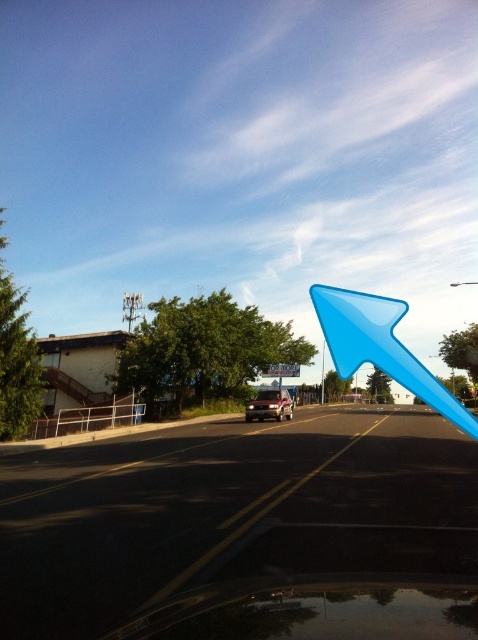
Question: Which of these objects is positioned closest to the satin silver suv at center?

Choices:
 (A) blue plastic pole at center
 (B) black asphalt parking lot at center
 (C) white plastic street sign at center

Answer: (C)

Question: Does satin silver suv at center come in front of blue plastic pole at center?

Choices:
 (A) no
 (B) yes

Answer: (B)

Question: Estimate the real-world distances between objects in this image. Which object is farther from the satin silver suv at center?

Choices:
 (A) blue plastic pole at center
 (B) black asphalt parking lot at center
 (C) white plastic street sign at center

Answer: (A)

Question: Is black asphalt parking lot at center closer to the viewer compared to satin silver suv at center?

Choices:
 (A) yes
 (B) no

Answer: (A)

Question: Does black asphalt parking lot at center have a smaller size compared to blue plastic pole at center?

Choices:
 (A) yes
 (B) no

Answer: (B)

Question: Based on their relative distances, which object is nearer to the blue plastic pole at center?

Choices:
 (A) satin silver suv at center
 (B) white plastic street sign at center
 (C) black asphalt parking lot at center

Answer: (B)